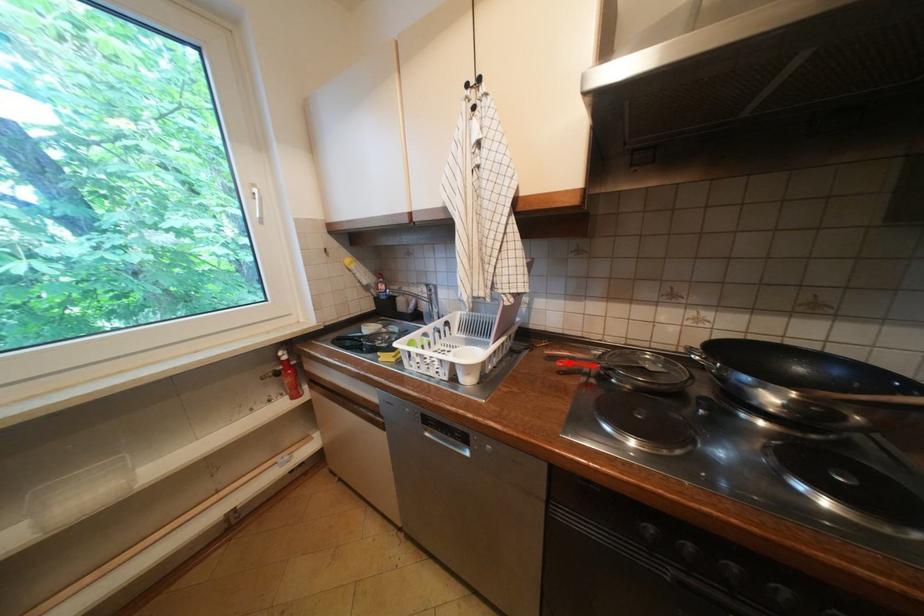
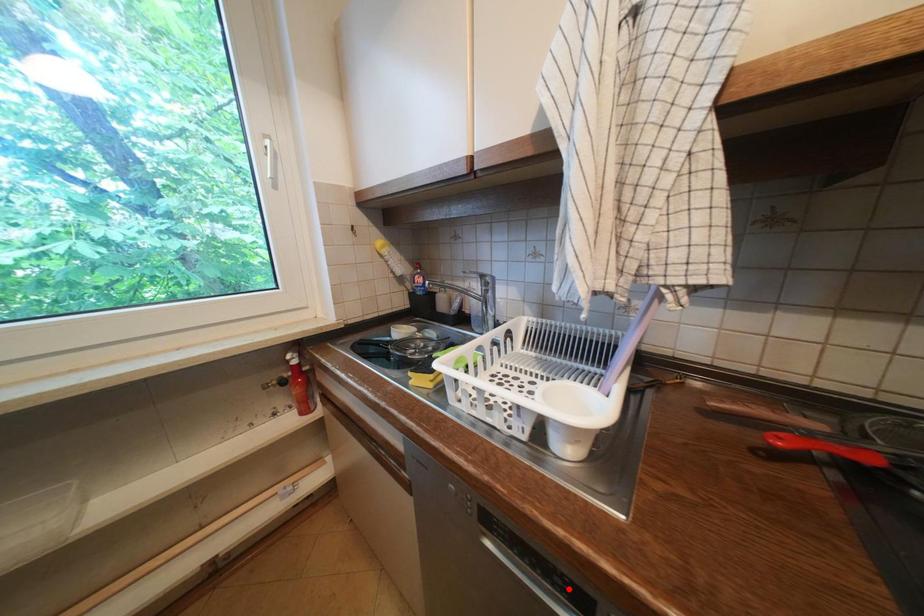
I am providing you with two images of the same scene from different viewpoints. A red point is marked on the first image and another point is marked on the second image. Does the point marked in image1 correspond to the same location as the one in image2?

No